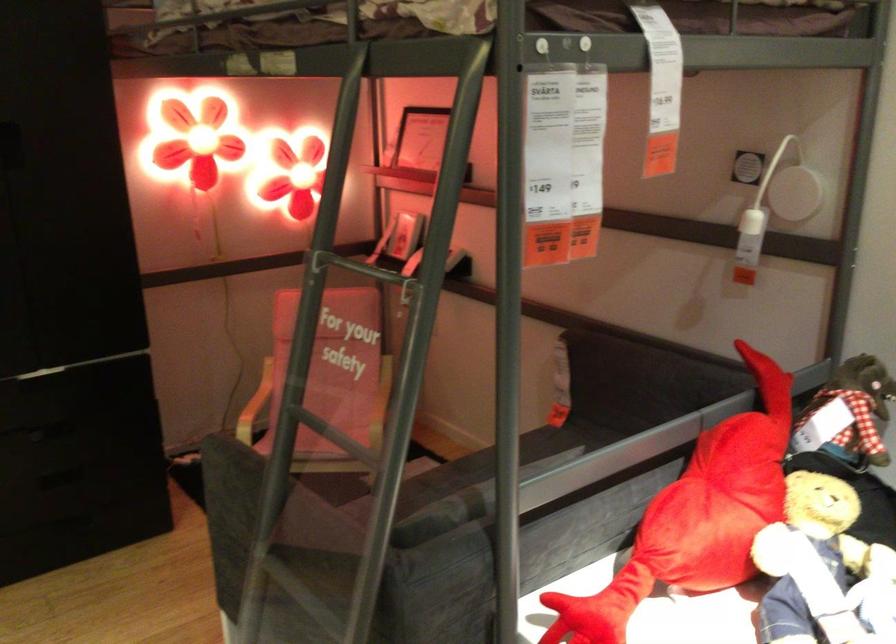
Where would you pull the black drawer handle? Please return your answer as a coordinate pair (x, y).

(19, 368)